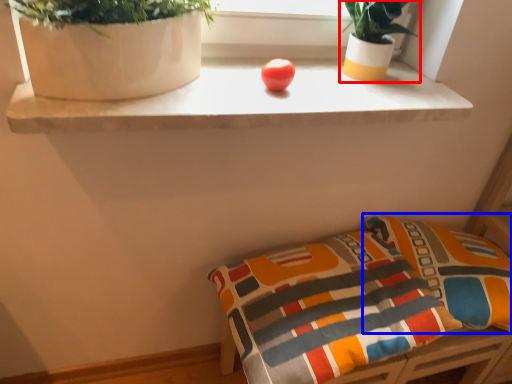
Question: Which object appears farthest to the camera in this image, houseplant (highlighted by a red box) or pillow (highlighted by a blue box)?

Choices:
 (A) houseplant
 (B) pillow

Answer: (B)